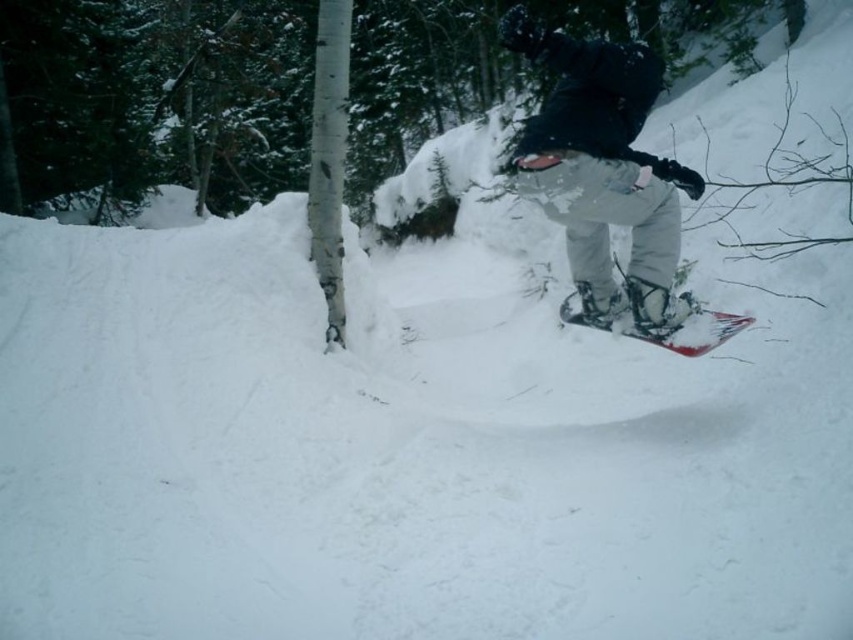
Consider the image. Who is more distant from viewer, [596,100] or [747,316]?

Point [747,316]

Which is in front, point (627, 294) or point (740, 326)?

Point (740, 326) is more forward.

Is point (717, 342) more distant than point (747, 324)?

No, (717, 342) is closer to viewer.

This screenshot has width=853, height=640. I want to click on matte black snowboard at center, so click(608, 179).